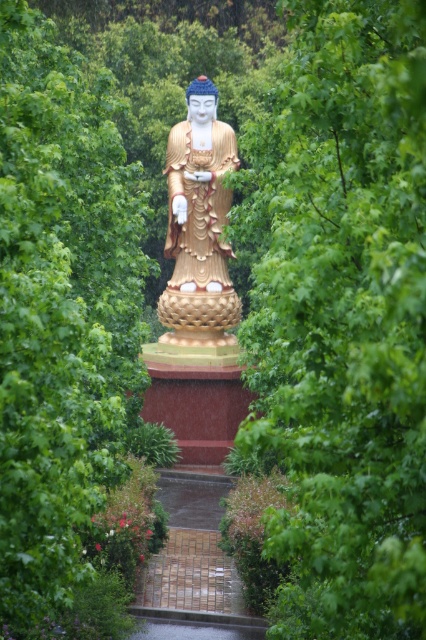
You are a photographer planning to take a picture of the gold polished statue at center and the green leafy bush at center. Based on their heights, which one should you focus on first to ensure both are in frame?

The green leafy bush at center is taller than the gold polished statue at center, so you should focus on the green leafy bush at center first to ensure both are in frame.

You are standing at the base of the golden Buddha statue and see a point marked at coordinates (345, 321). According to the scene description, where is this point located?

The point at (345, 321) is located on the green leafy tree at center.